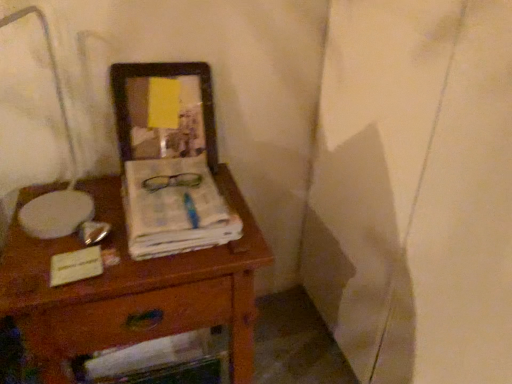
The width and height of the screenshot is (512, 384). I want to click on vacant position to the left of white paper at center, so click(x=68, y=225).